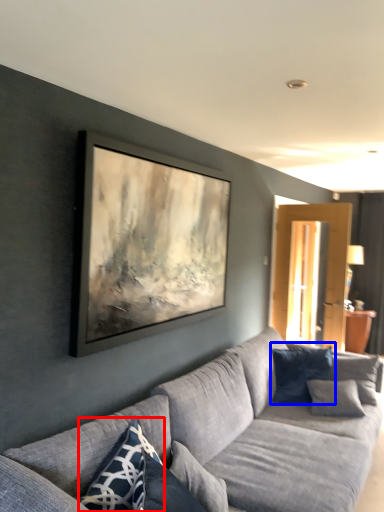
Question: Which of the following is the farthest to the observer, pillow (highlighted by a red box) or pillow (highlighted by a blue box)?

Choices:
 (A) pillow
 (B) pillow

Answer: (B)